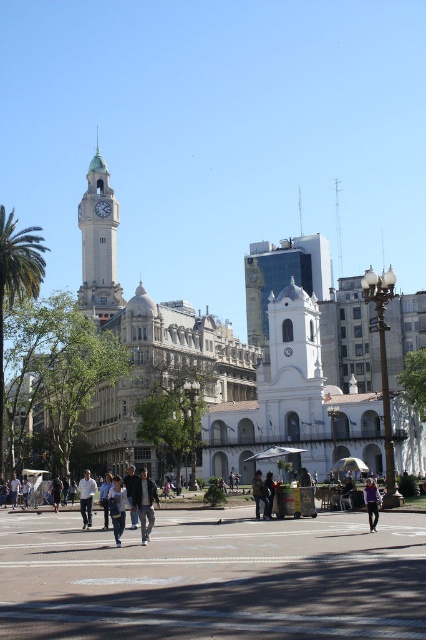
Question: Which point is closer to the camera?

Choices:
 (A) dark blue jeans at center
 (B) denim jacket at center

Answer: (B)

Question: Where is denim jacket at center located in relation to white cotton shirt at center in the image?

Choices:
 (A) above
 (B) below

Answer: (A)

Question: Does green leafy palm tree at left have a lesser width compared to dark gray jacket at center?

Choices:
 (A) yes
 (B) no

Answer: (B)

Question: Which point is closer to the camera?

Choices:
 (A) [x=267, y=502]
 (B) [x=57, y=480]

Answer: (A)

Question: Estimate the real-world distances between objects in this image. Which object is closer to the purple matte jacket at lower right?

Choices:
 (A) light gray stone clock tower at upper left
 (B) dark gray jacket at center
 (C) concrete pavement at center
 (D) khaki fabric jacket at center

Answer: (D)

Question: Where is purple matte jacket at lower right located in relation to khaki fabric jacket at center in the image?

Choices:
 (A) above
 (B) below

Answer: (A)